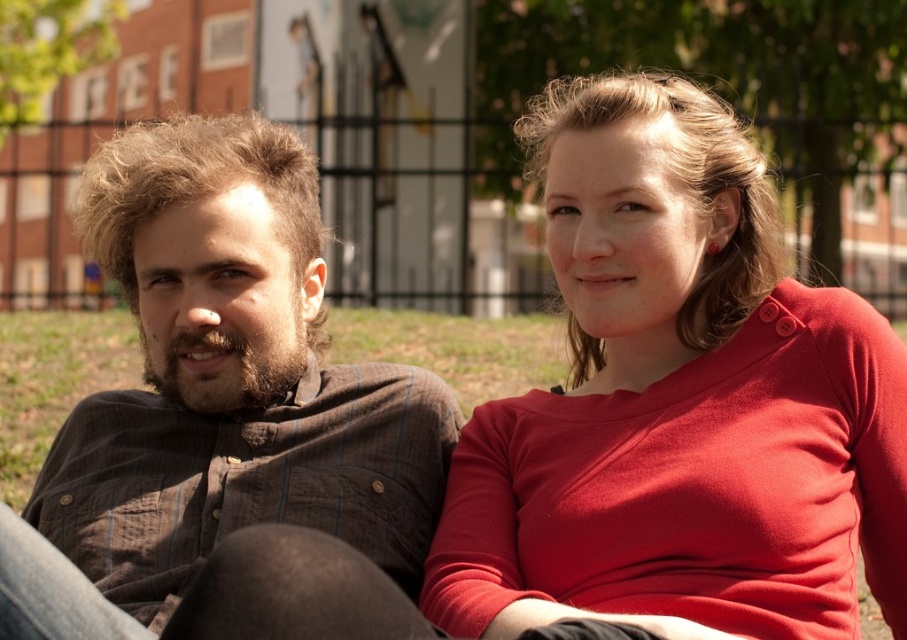
Does matte red sweater at center have a smaller size compared to brown striped shirt at left?

Incorrect, matte red sweater at center is not smaller in size than brown striped shirt at left.

Identify the location of matte red sweater at center. This screenshot has width=907, height=640. (678, 401).

This screenshot has width=907, height=640. What are the coordinates of `matte red sweater at center` in the screenshot? It's located at (678, 401).